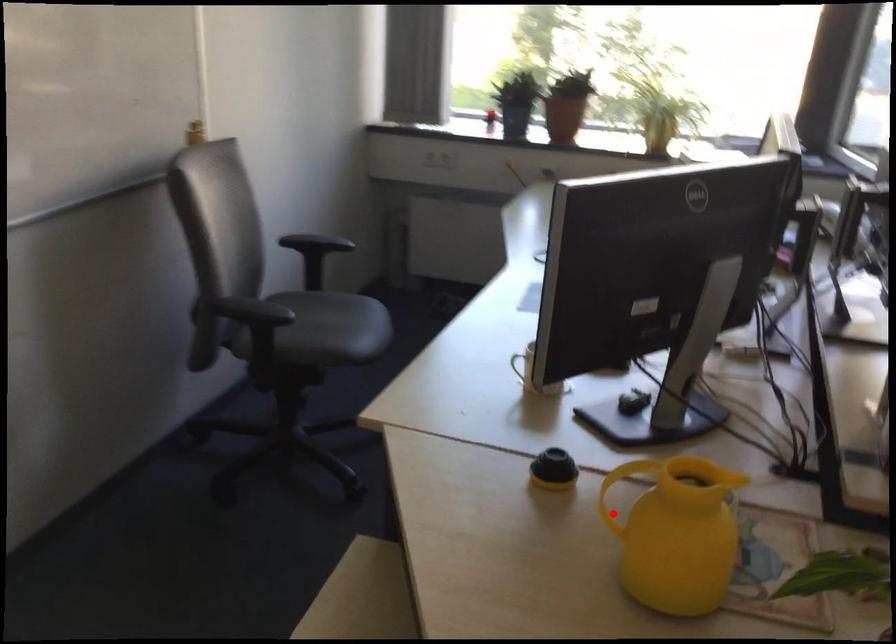
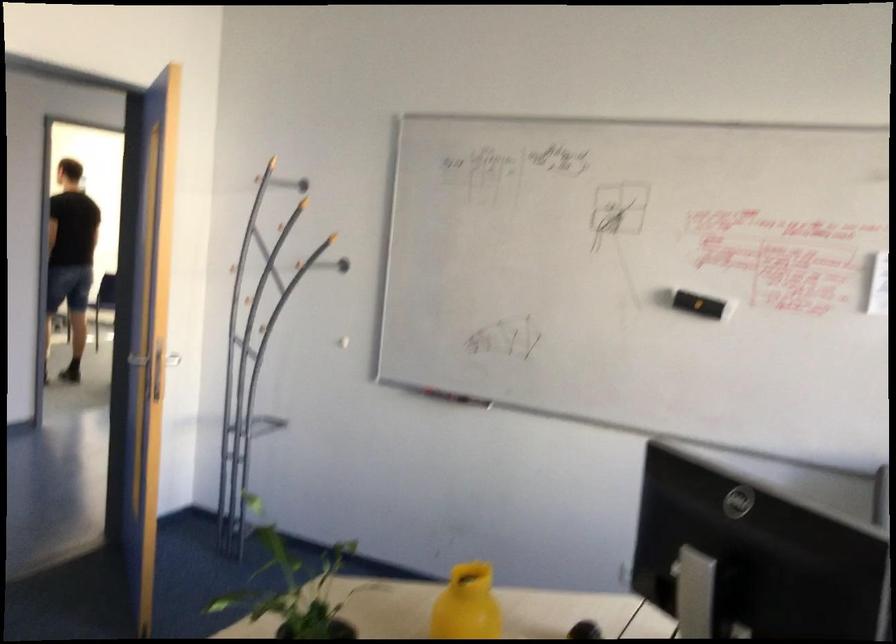
Where in the second image is the point corresponding to the highlighted location from the first image?

(467, 605)